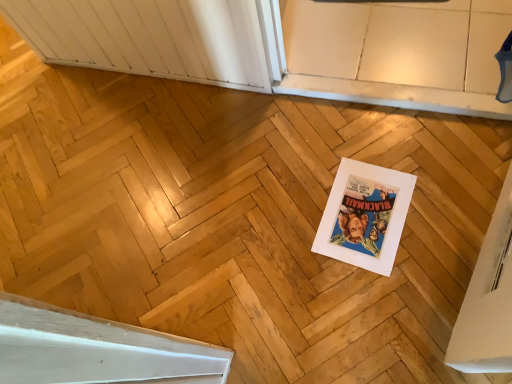
Where is `vacant space behind white paper comic book at center`? The height and width of the screenshot is (384, 512). vacant space behind white paper comic book at center is located at coordinates (330, 151).